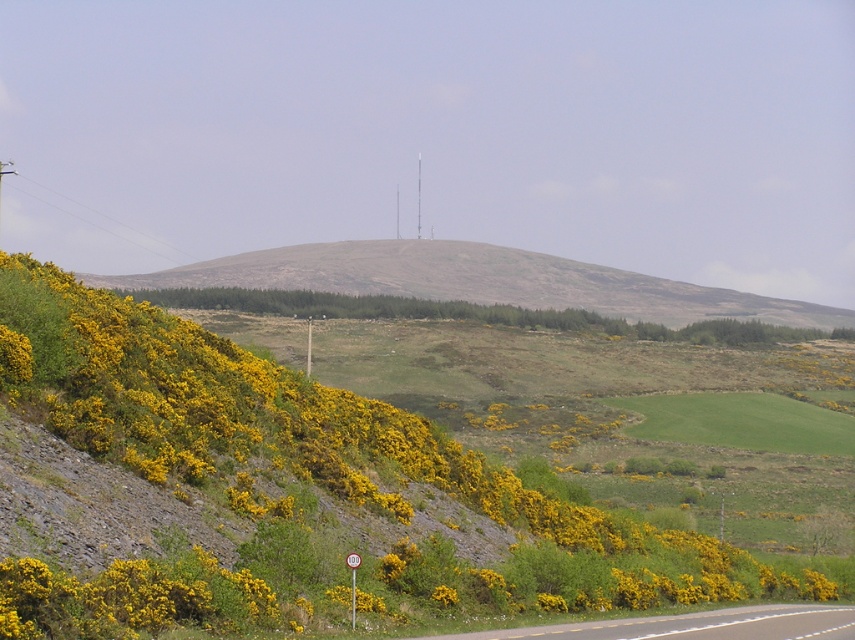
You are a hiker trying to decide where to set up your tent. You have two options near the yellow rough textured bush at left and the grassy hillside at center. Which location would provide more space for your tent and equipment?

The grassy hillside at center occupies more space than the yellow rough textured bush at left, so setting up the tent there would provide more space for your equipment.

You are standing at the bottom of the hillside and want to walk to the yellow rough textured bush at left and the grassy hillside at center. Which one is easier to reach first?

The yellow rough textured bush at left is closer to the viewer than the grassy hillside at center, so you can reach the yellow rough textured bush at left first.